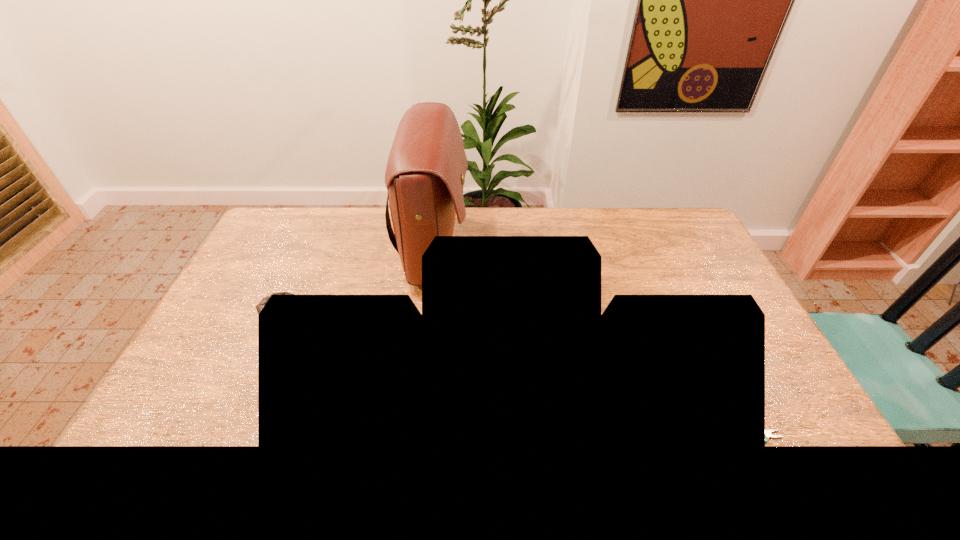
Where is `object that is at the near edge`? This screenshot has width=960, height=540. object that is at the near edge is located at coordinates (768, 432).

I want to click on object that is positioned at the left edge, so click(x=259, y=307).

What are the coordinates of `object present at the right edge` in the screenshot? It's located at (768, 432).

Locate an element on the screen. The width and height of the screenshot is (960, 540). object located in the near right corner section of the desktop is located at coordinates (768, 432).

The image size is (960, 540). In the image, there is a desktop. Identify the location of vacant space at the far edge. (574, 222).

The image size is (960, 540). What are the coordinates of `blank space at the near edge of the desktop` in the screenshot? It's located at [x=503, y=433].

Where is `free space at the left edge of the desktop`? free space at the left edge of the desktop is located at coordinates (290, 255).

Where is `vacant space at the right edge of the desktop`? The width and height of the screenshot is (960, 540). vacant space at the right edge of the desktop is located at coordinates (700, 284).

Locate an element on the screen. Image resolution: width=960 pixels, height=540 pixels. free space at the far left corner of the desktop is located at coordinates (288, 223).

Where is `free space at the far right corner`? The image size is (960, 540). free space at the far right corner is located at coordinates (680, 227).